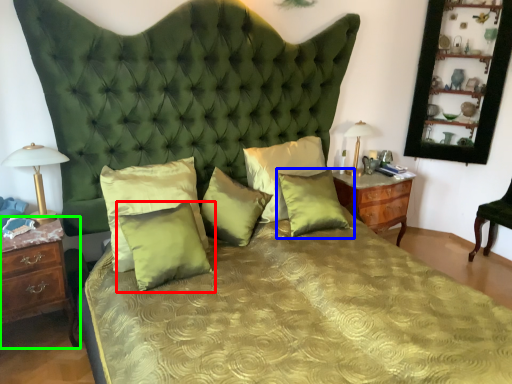
Question: Estimate the real-world distances between objects in this image. Which object is closer to pillow (highlighted by a red box), pillow (highlighted by a blue box) or nightstand (highlighted by a green box)?

Choices:
 (A) pillow
 (B) nightstand

Answer: (B)